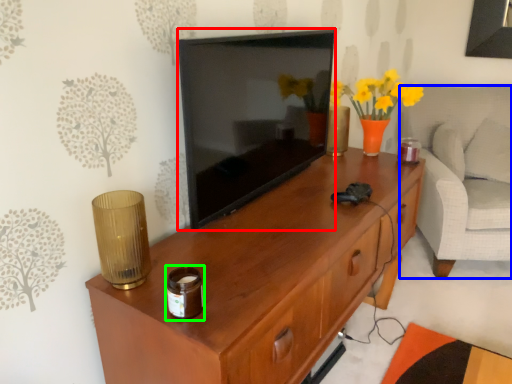
Question: Which is nearer to the television (highlighted by a red box)? armchair (highlighted by a blue box) or candle holder (highlighted by a green box).

Choices:
 (A) armchair
 (B) candle holder

Answer: (B)